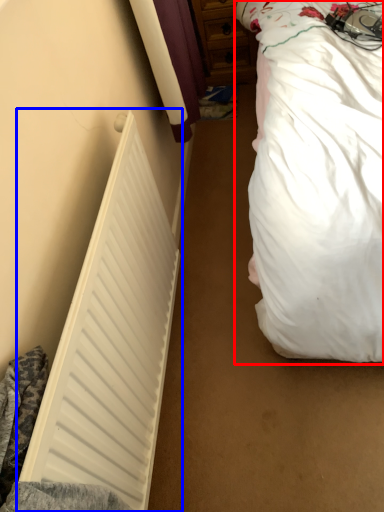
Question: Among these objects, which one is farthest to the camera, bed (highlighted by a red box) or radiator (highlighted by a blue box)?

Choices:
 (A) bed
 (B) radiator

Answer: (B)